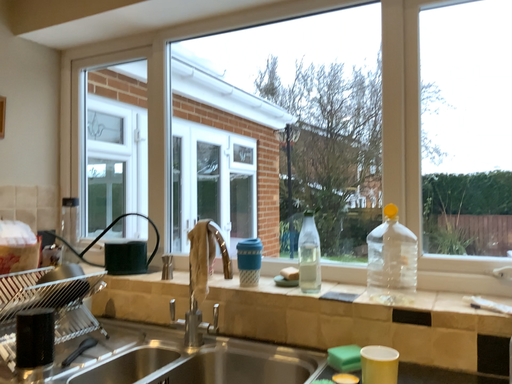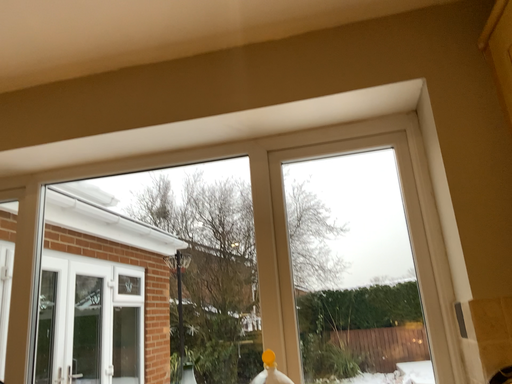
Question: How did the camera likely rotate when shooting the video?

Choices:
 (A) rotated right
 (B) rotated left

Answer: (A)